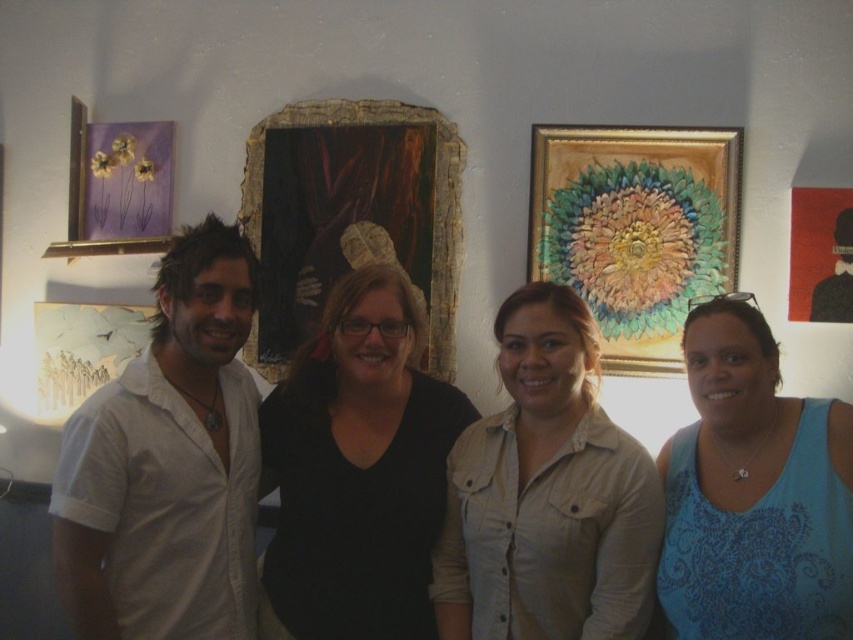
Question: Which point is farther from the camera taking this photo?

Choices:
 (A) (287, 576)
 (B) (828, 493)
 (C) (646, 502)
 (D) (663, 264)

Answer: (D)

Question: Which point is farther from the camera taking this photo?

Choices:
 (A) (200, 321)
 (B) (732, 609)
 (C) (610, 451)

Answer: (A)

Question: Is beige button-up shirt at center thinner than gold textured painting at upper center?

Choices:
 (A) no
 (B) yes

Answer: (B)

Question: Can you confirm if black matte shirt at center is positioned to the right of gold textured painting at upper center?

Choices:
 (A) no
 (B) yes

Answer: (A)

Question: Which point is closer to the camera taking this photo?

Choices:
 (A) (721, 228)
 (B) (172, 456)
 (C) (401, 484)

Answer: (B)

Question: Can you confirm if blue printed tank top at right is bigger than gold textured painting at upper center?

Choices:
 (A) no
 (B) yes

Answer: (B)